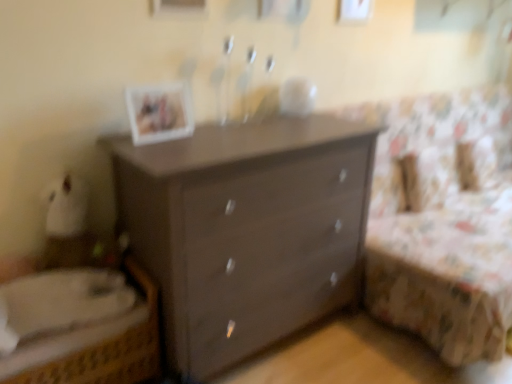
Locate an element on the screen. This screenshot has width=512, height=384. free point above woven wicker bed at lower left (from a real-world perspective) is located at coordinates (81, 289).